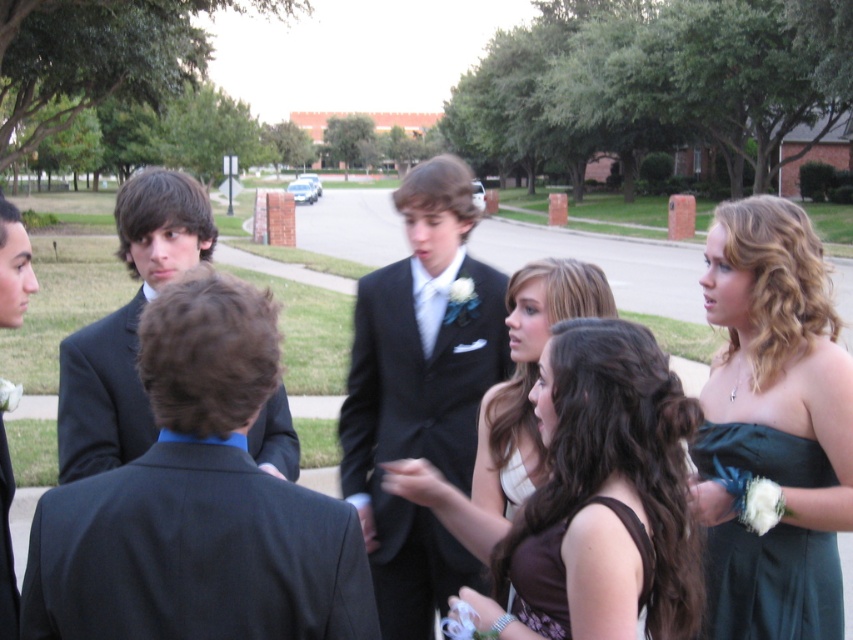
You are standing in the prom photo scene and want to move from the point at coordinates point [126,260] to the point at coordinates point [757,611]. Which direction should you face to walk towards the second point?

You should face towards the lower right direction because point [757,611] is located further away from the viewer compared to point [126,260].

Consider the image. You are a photographer trying to capture a group photo of the matte black suit at left and the dark green satin dress at lower right. The camera can only focus on objects within a 3 meter width. Given their widths, will both fit within the frame?

The matte black suit at left is wider than the dark green satin dress at lower right. However, since the camera can focus on objects within a 3 meter width, both will fit as their combined width is less than 3 meters.

You are a photographer trying to capture a group photo of the dark green satin dress at right and the dark green satin dress at lower right. The camera you are using has a maximum focus range of 2.5 inches. Can you fit both dresses into the frame without moving the camera?

The dark green satin dress at right and dark green satin dress at lower right are 2.60 inches apart, which exceeds the camera maximum focus range of 2.5 inches. Therefore, you cannot fit both dresses into the frame without moving the camera.